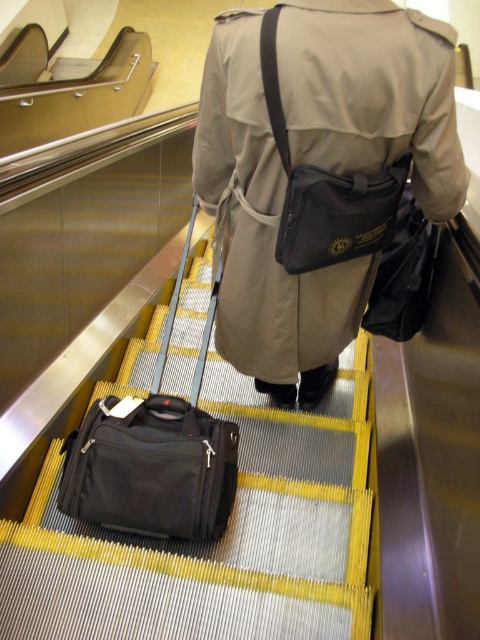
Image resolution: width=480 pixels, height=640 pixels. In order to click on black fabric suitcase at center in this screenshot , I will do `click(222, 536)`.

Where is `black fabric suitcase at center`? black fabric suitcase at center is located at coordinates (222, 536).

Is matte black bag at center wider than black fabric bag at lower left?

Correct, the width of matte black bag at center exceeds that of black fabric bag at lower left.

Does point (247, 234) come farther from viewer compared to point (73, 451)?

That is False.

Where is `matte black bag at center`? The image size is (480, 640). matte black bag at center is located at coordinates (264, 234).

Is point (346, 621) more distant than point (252, 253)?

No, it is not.

Can you confirm if black fabric suitcase at center is positioned above matte black bag at center?

No, black fabric suitcase at center is not above matte black bag at center.

Locate an element on the screen. The image size is (480, 640). black fabric suitcase at center is located at coordinates (222, 536).

Identify the location of black fabric suitcase at center. (222, 536).